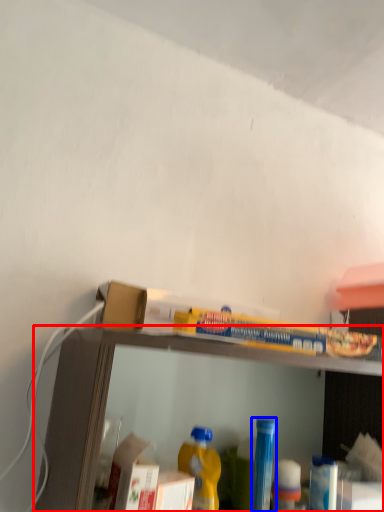
Question: Among these objects, which one is nearest to the camera, shelf (highlighted by a red box) or bottle (highlighted by a blue box)?

Choices:
 (A) shelf
 (B) bottle

Answer: (A)